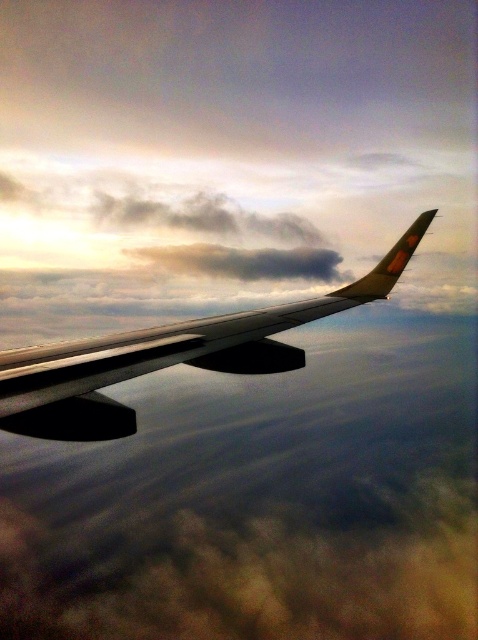
You are a photographer capturing the airplane wing from an aerial view. You notice two points on the wing labeled as point (165, 344) and point (223, 259). Which point appears closer to your camera lens in the photo?

Point (165, 344) is closer to the camera than point (223, 259).

You are a passenger looking out the window of the airplane. You see the metallic silver wing at upper center and the gray fluffy cloud at upper center. Which object is positioned more to the left?

The metallic silver wing at upper center is positioned more to the left than the gray fluffy cloud at upper center.

You are a passenger sitting near the window and looking at the view outside. You notice the metallic silver wing at upper center and the gray fluffy cloud at upper center. Which object is closer to you?

The metallic silver wing at upper center is closer to you than the gray fluffy cloud at upper center.